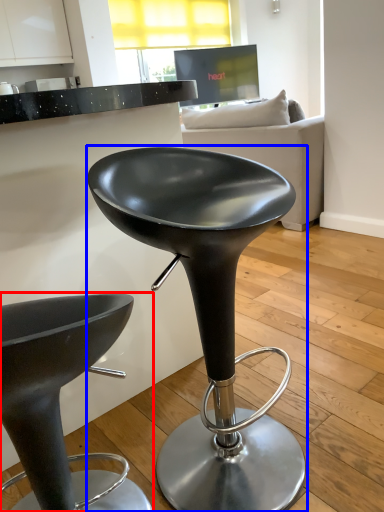
Question: Which of the following is the farthest to the observer, stool (highlighted by a red box) or stool (highlighted by a blue box)?

Choices:
 (A) stool
 (B) stool

Answer: (B)